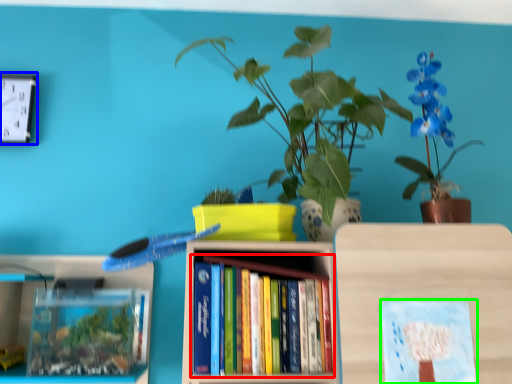
Question: Which object is positioned farthest from book (highlighted by a red box)? Select from clock (highlighted by a blue box) and book cover (highlighted by a green box).

Choices:
 (A) clock
 (B) book cover

Answer: (A)